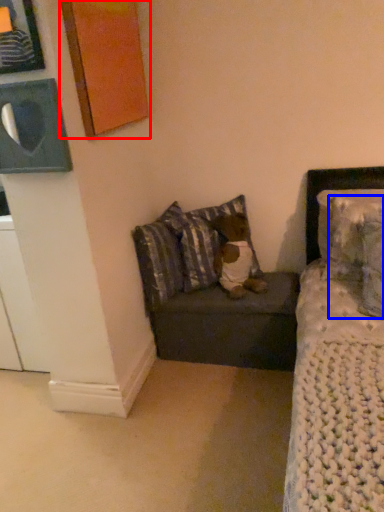
Question: Which point is closer to the camera, picture frame (highlighted by a red box) or pillow (highlighted by a blue box)?

Choices:
 (A) picture frame
 (B) pillow

Answer: (B)